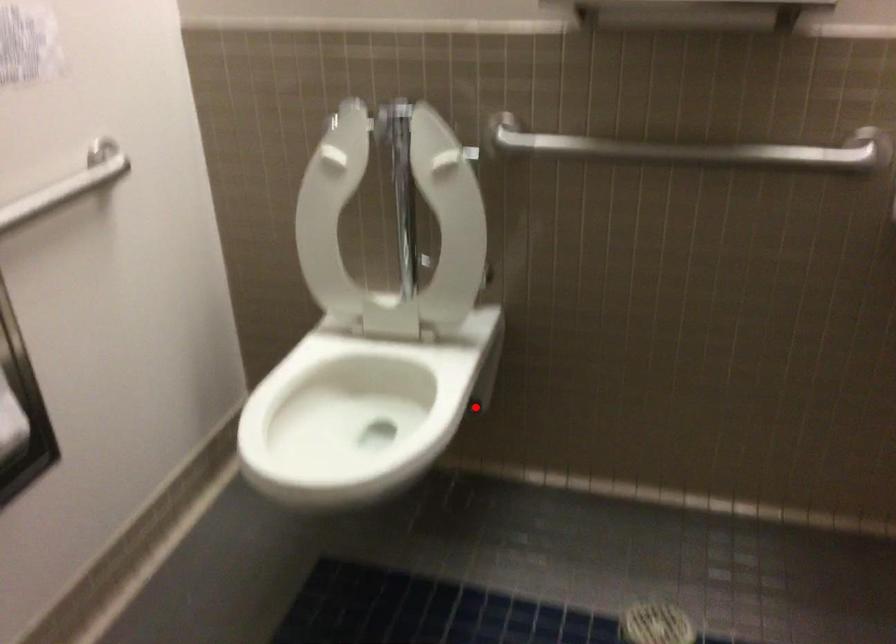
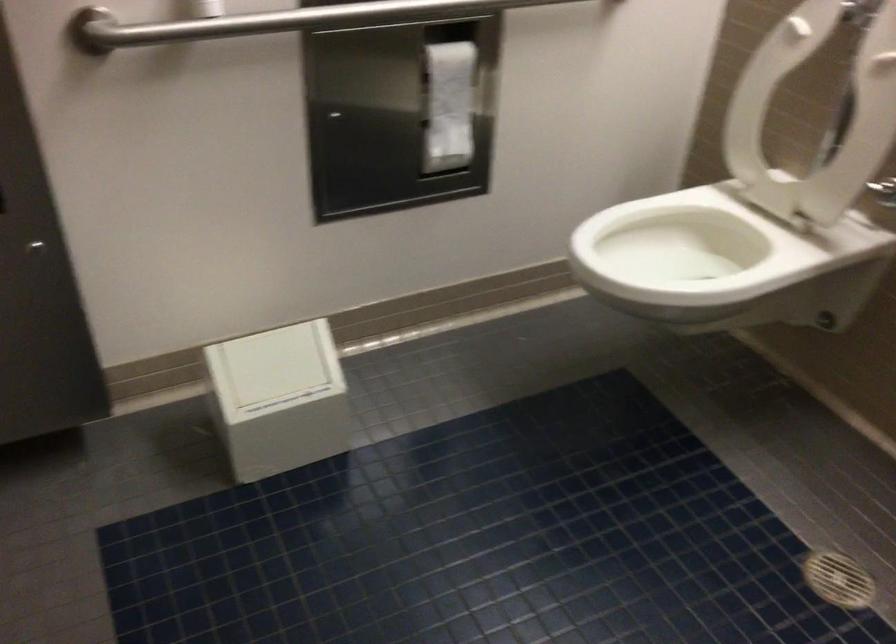
In the second image, find the point that corresponds to the highlighted location in the first image.

(824, 321)